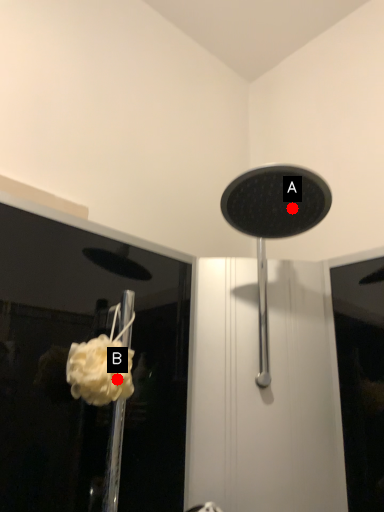
Question: Two points are circled on the image, labeled by A and B beside each circle. Which point is closer to the camera?

Choices:
 (A) A is closer
 (B) B is closer

Answer: (B)